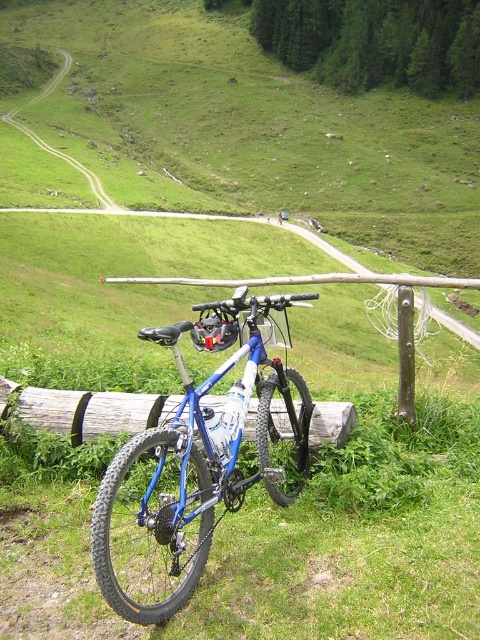
Question: Which point is closer to the camera?

Choices:
 (A) (116, 404)
 (B) (168, 339)

Answer: (B)

Question: Can you confirm if blue metallic mountain bike at center is thinner than wooden log at center?

Choices:
 (A) no
 (B) yes

Answer: (B)

Question: Is blue metallic mountain bike at center smaller than wooden log at center?

Choices:
 (A) yes
 (B) no

Answer: (B)

Question: Among these objects, which one is farthest from the camera?

Choices:
 (A) blue metallic mountain bike at center
 (B) wooden log at center

Answer: (B)

Question: Is blue metallic mountain bike at center smaller than wooden log at center?

Choices:
 (A) yes
 (B) no

Answer: (B)